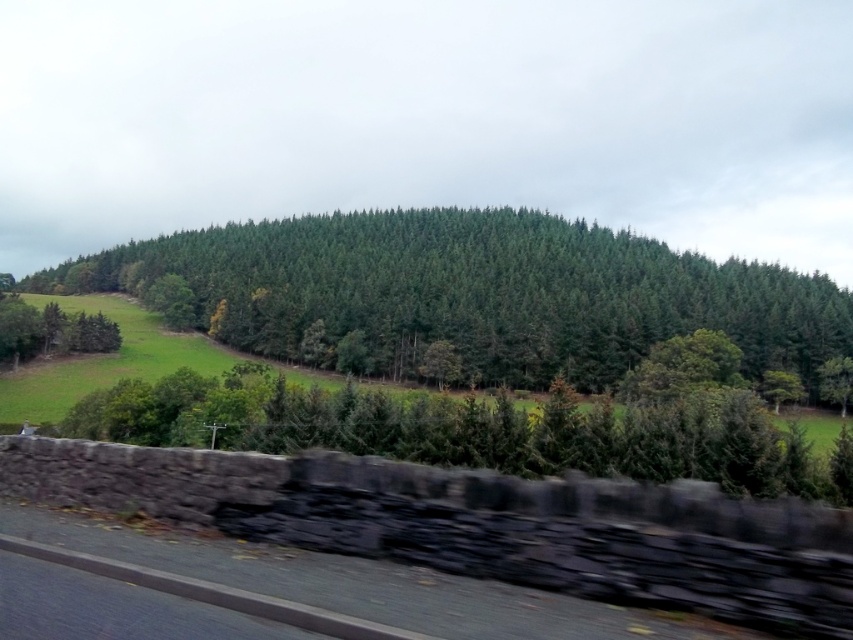
Question: Is green matte forest at center in front of black asphalt highway at lower left?

Choices:
 (A) no
 (B) yes

Answer: (A)

Question: Which point appears farthest from the camera in this image?

Choices:
 (A) (221, 547)
 (B) (578, 364)

Answer: (B)

Question: Which object appears farthest from the camera in this image?

Choices:
 (A) green matte forest at center
 (B) black asphalt highway at lower left

Answer: (A)

Question: Which point is farther to the camera?

Choices:
 (A) (148, 563)
 (B) (223, 230)

Answer: (B)

Question: Is green matte forest at center bigger than black asphalt highway at lower left?

Choices:
 (A) no
 (B) yes

Answer: (B)

Question: Does green matte forest at center have a lesser width compared to black asphalt highway at lower left?

Choices:
 (A) no
 (B) yes

Answer: (A)